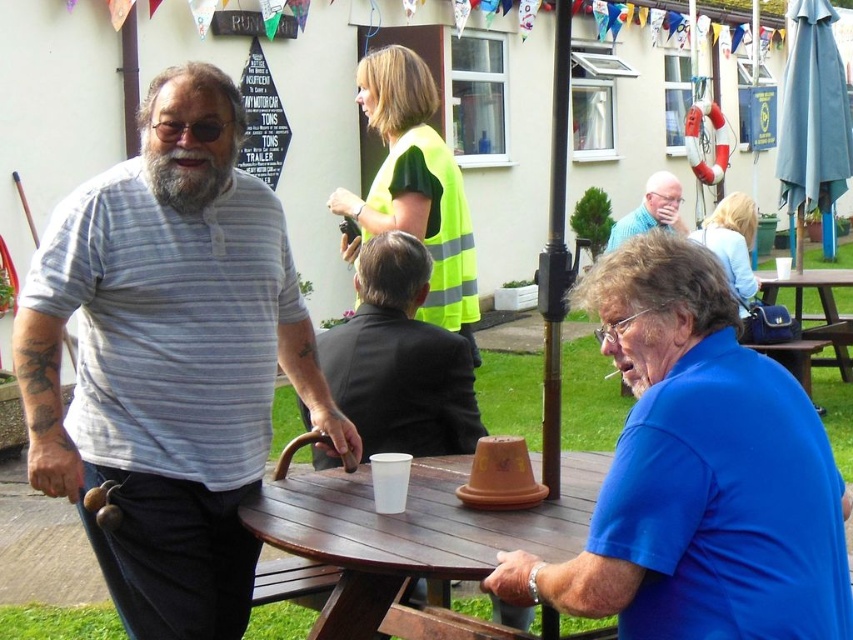
From the picture: You are organizing a photo shoot and need to place two props on a shelf. The shelf has limited space. Based on the scene description, which object, the matte black suit at center or the blue cotton shirt at upper right, is wider and would require more space on the shelf?

The matte black suit at center might be wider than blue cotton shirt at upper right, so it would require more space on the shelf.

You are at a community event and need to locate the matte black suit at center. According to the coordinates provided, where would you find it in the image?

The matte black suit at center is located at the coordinates point (399, 358) in the image.